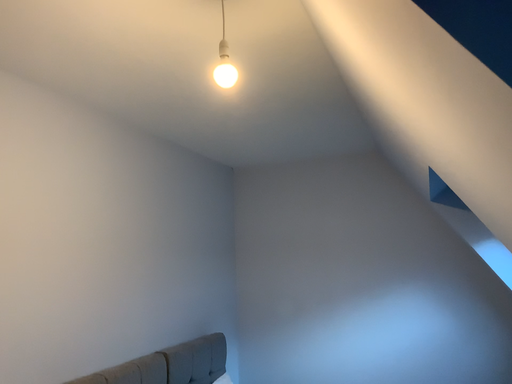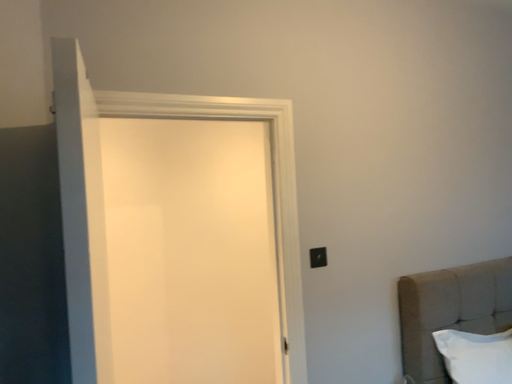
Question: How did the camera likely rotate when shooting the video?

Choices:
 (A) rotated left
 (B) rotated right

Answer: (A)